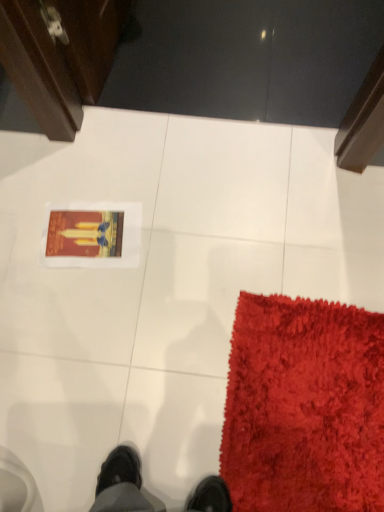
Identify the location of free space behind shaggy red rug at lower right. tap(261, 252).